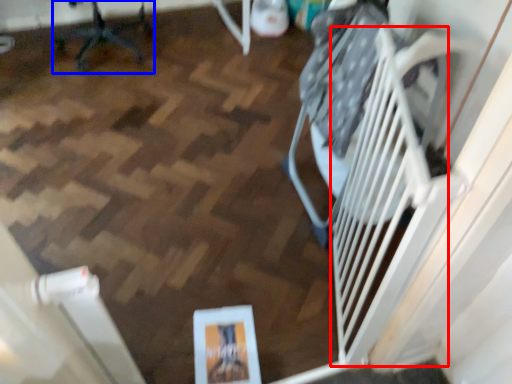
Question: Which object is closer to the camera taking this photo, stairs (highlighted by a red box) or furniture (highlighted by a blue box)?

Choices:
 (A) stairs
 (B) furniture

Answer: (A)